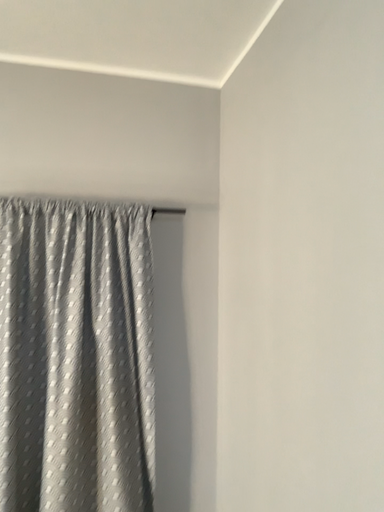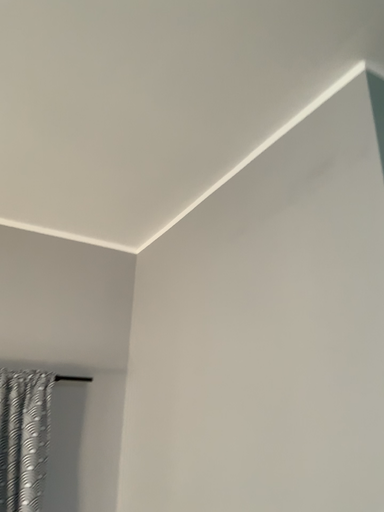
Question: How did the camera likely rotate when shooting the video?

Choices:
 (A) rotated right
 (B) rotated left

Answer: (A)